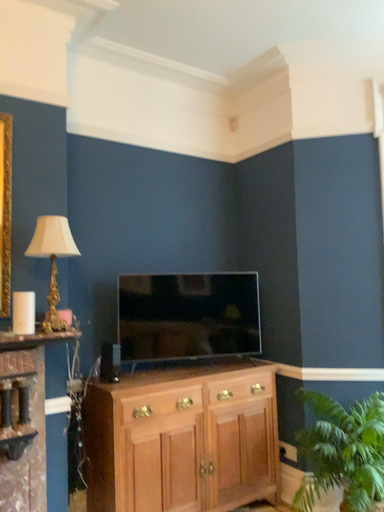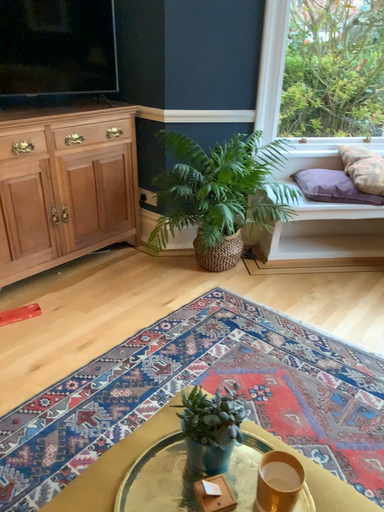
Question: Which way did the camera rotate in the video?

Choices:
 (A) rotated upward
 (B) rotated downward

Answer: (B)